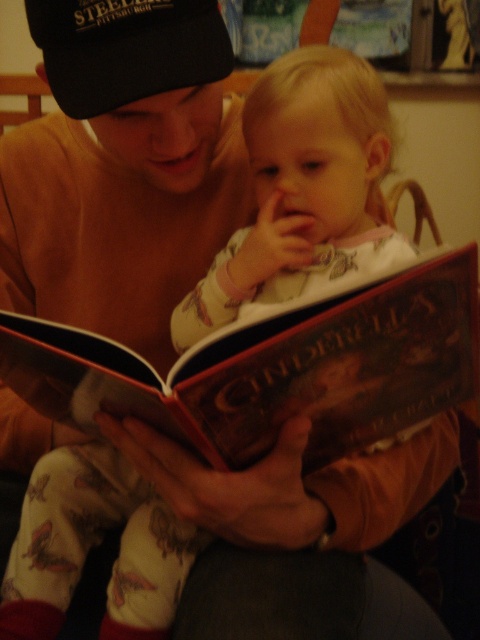
Is hardcover book at center taller than black fabric baseball cap at upper left?

Yes, hardcover book at center is taller than black fabric baseball cap at upper left.

Can you confirm if hardcover book at center is shorter than black fabric baseball cap at upper left?

No.

Locate an element on the screen. The height and width of the screenshot is (640, 480). hardcover book at center is located at coordinates (274, 369).

Does matte brown sweater at upper left have a greater height compared to black fabric baseball cap at upper left?

Indeed, matte brown sweater at upper left has a greater height compared to black fabric baseball cap at upper left.

Who is shorter, matte brown sweater at upper left or black fabric baseball cap at upper left?

black fabric baseball cap at upper left is shorter.

This screenshot has width=480, height=640. Describe the element at coordinates (122, 168) in the screenshot. I see `matte brown sweater at upper left` at that location.

Where is `matte brown sweater at upper left`? Image resolution: width=480 pixels, height=640 pixels. matte brown sweater at upper left is located at coordinates (122, 168).

Which of these two, matte brown sweater at upper left or hardcover book at center, stands shorter?

hardcover book at center is shorter.

In the scene shown: Who is more forward, (x=121, y=189) or (x=434, y=300)?

Point (x=434, y=300) is more forward.

This screenshot has height=640, width=480. Find the location of `matte brown sweater at upper left`. matte brown sweater at upper left is located at coordinates (122, 168).